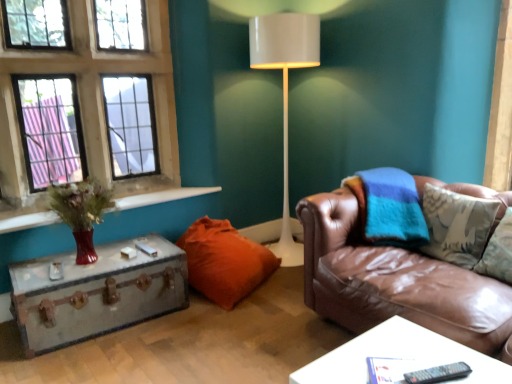
Find the location of a particular element. free space to the right of metallic suitcase at left, placed as the second table when sorted from right to left is located at coordinates (199, 336).